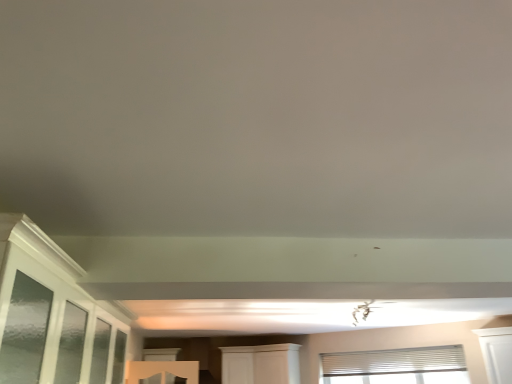
Question: Is clear glass window at lower center, the 1th window in the left-to-right sequence, completely or partially outside of white textured blinds at upper right, the 1th window in the right-to-left sequence?

Choices:
 (A) no
 (B) yes

Answer: (B)

Question: From the image's perspective, is clear glass window at lower center, which is the 2th window from right to left, over white textured blinds at upper right, the 1th window in the right-to-left sequence?

Choices:
 (A) no
 (B) yes

Answer: (A)

Question: From the image's perspective, does clear glass window at lower center, which is the 2th window from right to left, appear lower than white textured blinds at upper right, the 1th window in the right-to-left sequence?

Choices:
 (A) no
 (B) yes

Answer: (B)

Question: Can you confirm if clear glass window at lower center, the 1th window in the left-to-right sequence, is thinner than white textured blinds at upper right, the 1th window in the right-to-left sequence?

Choices:
 (A) no
 (B) yes

Answer: (A)

Question: Does clear glass window at lower center, which is the 2th window from right to left, have a greater height compared to white textured blinds at upper right, marked as the 2th window in a left-to-right arrangement?

Choices:
 (A) yes
 (B) no

Answer: (A)

Question: Is clear glass window at lower center, which is the 2th window from right to left, smaller than white textured blinds at upper right, the 1th window in the right-to-left sequence?

Choices:
 (A) no
 (B) yes

Answer: (A)

Question: From the image's perspective, is white wood cabinet at center below clear glass window at lower center, the 1th window in the left-to-right sequence?

Choices:
 (A) yes
 (B) no

Answer: (B)

Question: Considering the relative sizes of white wood cabinet at center and clear glass window at lower center, the 1th window in the left-to-right sequence, in the image provided, is white wood cabinet at center thinner than clear glass window at lower center, the 1th window in the left-to-right sequence,?

Choices:
 (A) yes
 (B) no

Answer: (B)

Question: Considering the relative positions of white wood cabinet at center and clear glass window at lower center, which is the 2th window from right to left, in the image provided, is white wood cabinet at center to the left of clear glass window at lower center, which is the 2th window from right to left, from the viewer's perspective?

Choices:
 (A) yes
 (B) no

Answer: (B)

Question: Is clear glass window at lower center, the 1th window in the left-to-right sequence, surrounded by white wood cabinet at center?

Choices:
 (A) yes
 (B) no

Answer: (B)

Question: Can you see white wood cabinet at center touching clear glass window at lower center, which is the 2th window from right to left?

Choices:
 (A) no
 (B) yes

Answer: (A)

Question: Is white wood cabinet at center outside clear glass window at lower center, which is the 2th window from right to left?

Choices:
 (A) yes
 (B) no

Answer: (A)

Question: From the image's perspective, does white wood cabinet at center appear lower than white textured blinds at upper right, marked as the 2th window in a left-to-right arrangement?

Choices:
 (A) no
 (B) yes

Answer: (B)